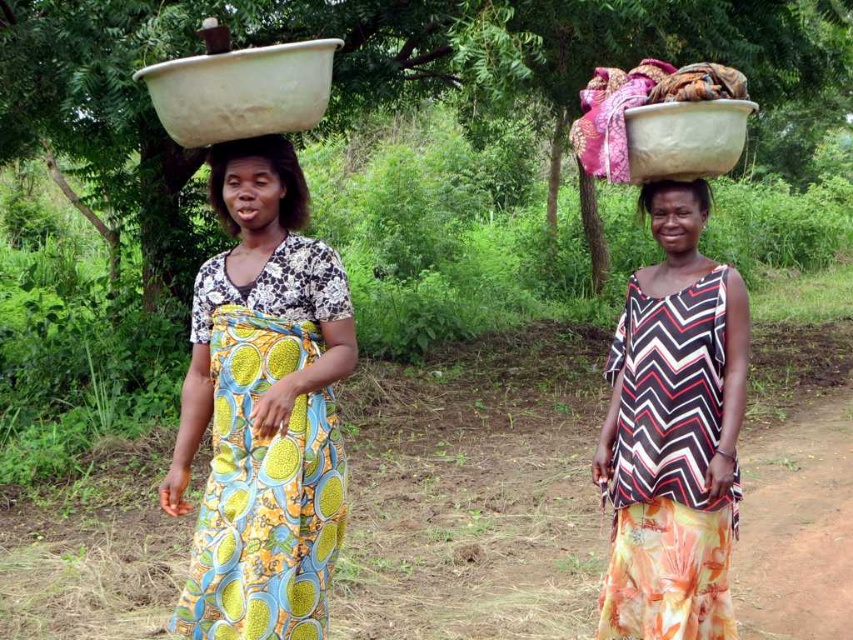
You are taking a photo of two women carrying bowls on their heads. You want to focus on the point closer to the camera. Which point should you choose between point (207, 262) and point (642, 211)?

Point (207, 262) is closer to the camera than point (642, 211), so you should choose point (207, 262) to focus on.

You are a photographer trying to capture both bowls in a single shot. Since the white matte bowl at upper right and the matte plastic bowl at upper center are at different distances from you, which one should you focus on first to ensure both are in focus?

You should focus on the matte plastic bowl at upper center first because it is farther away than the white matte bowl at upper right, ensuring both are in focus.